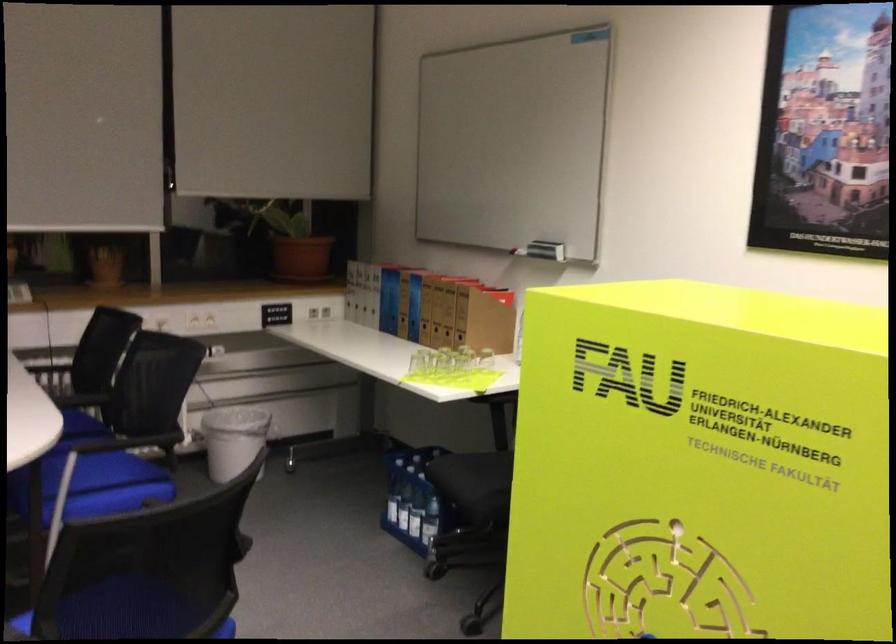
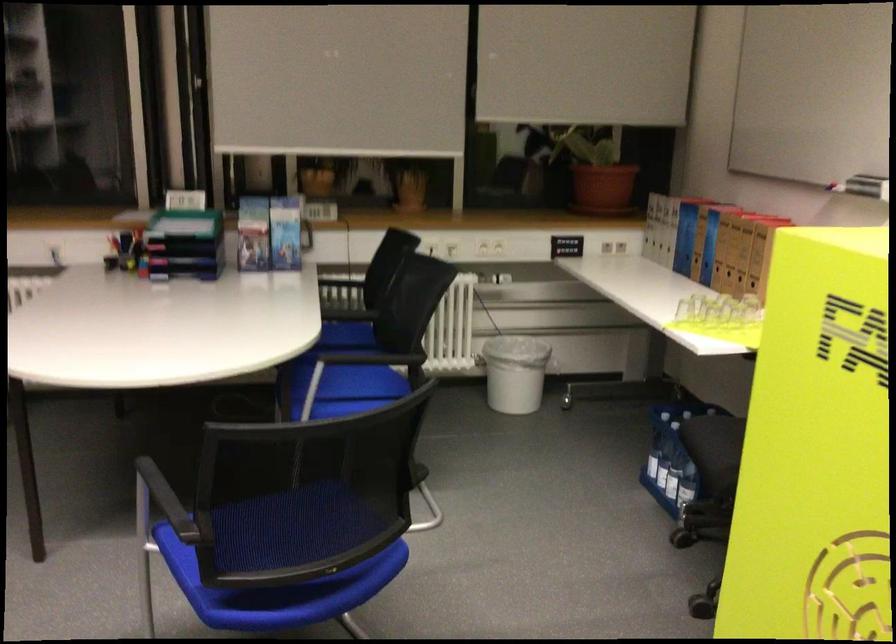
Question: The camera is either moving clockwise (left) or counter-clockwise (right) around the object. The first image is from the beginning of the video and the second image is from the end. Is the camera moving left or right when shooting the video?

Choices:
 (A) Left
 (B) Right

Answer: (B)